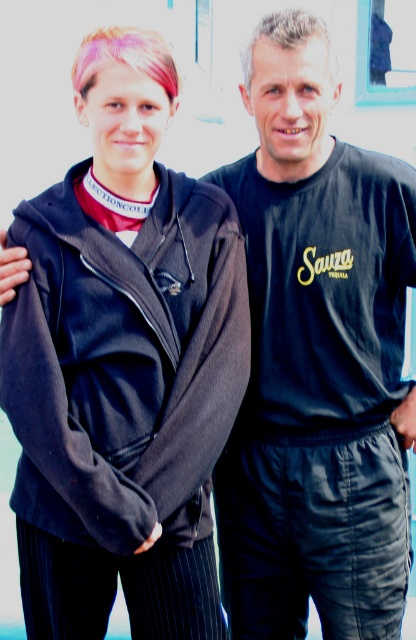
Is point (200, 220) farther from camera compared to point (336, 76)?

Yes, it is behind point (336, 76).

Can you confirm if dark gray fleece sweatshirt at left is positioned above slightly grayish blonde hair at upper center?

Actually, dark gray fleece sweatshirt at left is below slightly grayish blonde hair at upper center.

Between point (69, 316) and point (291, 16), which one is positioned in front?

Point (69, 316) is more forward.

The width and height of the screenshot is (416, 640). Identify the location of dark gray fleece sweatshirt at left. (124, 364).

Which is below, pink dyed hair at upper left or slightly grayish blonde hair at upper center?

Positioned lower is pink dyed hair at upper left.

Find the location of a particular element. pink dyed hair at upper left is located at coordinates (124, 56).

Can you confirm if dark gray fleece sweatshirt at left is positioned to the left of pink dyed hair at upper left?

Yes, dark gray fleece sweatshirt at left is to the left of pink dyed hair at upper left.

I want to click on dark gray fleece sweatshirt at left, so click(124, 364).